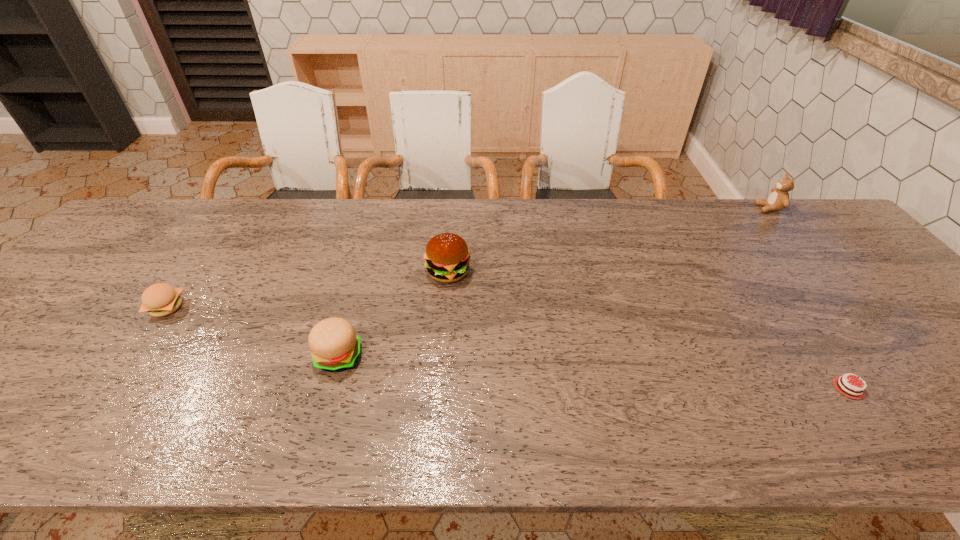
At what (x,y) coordinates should I click in order to perform the action: click on the rightmost object. Please return your answer as a coordinate pair (x, y). Looking at the image, I should click on (778, 200).

Locate an element on the screen. This screenshot has height=540, width=960. teddy bear is located at coordinates coord(778,200).

The image size is (960, 540). I want to click on the rightmost hamburger, so coord(447,256).

In order to click on the third object from right to left in this screenshot , I will do [447, 256].

The image size is (960, 540). I want to click on the third tallest object, so click(334, 345).

Where is `the nearest hamburger`? Image resolution: width=960 pixels, height=540 pixels. the nearest hamburger is located at coordinates (334, 345).

At what (x,y) coordinates should I click in order to perform the action: click on the shortest hamburger. Please return your answer as a coordinate pair (x, y). Looking at the image, I should click on (161, 299).

This screenshot has width=960, height=540. I want to click on the leftmost object, so 161,299.

The width and height of the screenshot is (960, 540). I want to click on the fourth object from left to right, so click(862, 396).

Find the location of a particular element. The width and height of the screenshot is (960, 540). the shortest object is located at coordinates (862, 396).